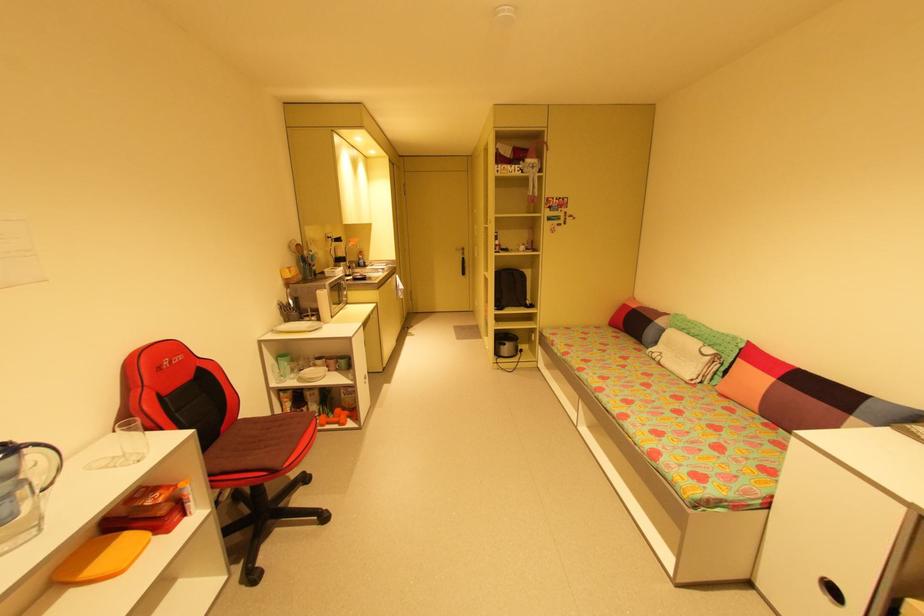
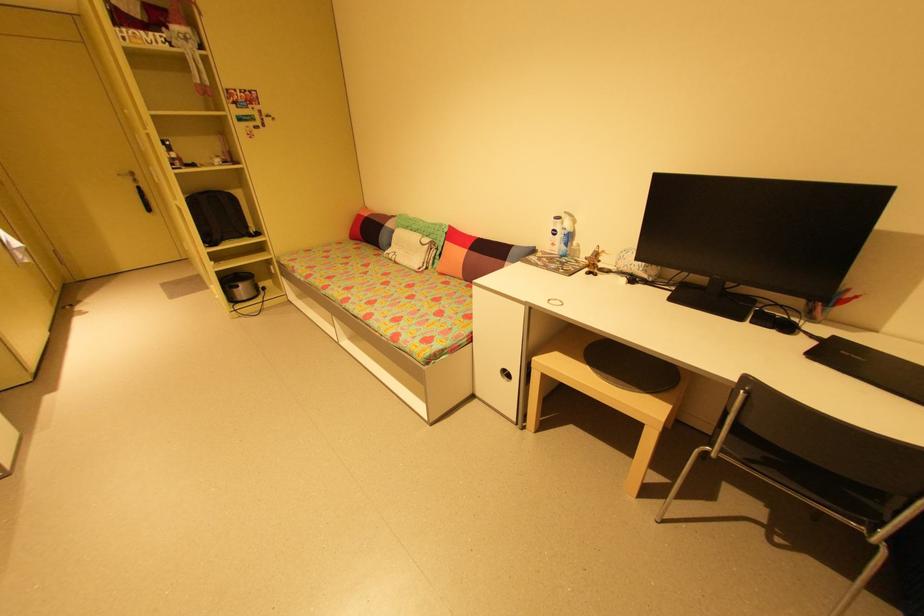
Find the pixel in the second image that matches point (721, 354) in the first image.

(435, 241)